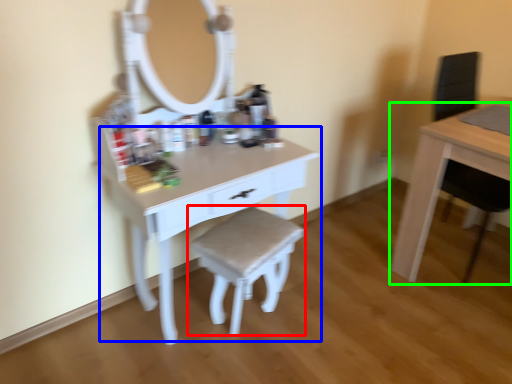
Question: Based on their relative distances, which object is nearer to stool (highlighted by a red box)? Choose from table (highlighted by a blue box) and table (highlighted by a green box).

Choices:
 (A) table
 (B) table

Answer: (A)